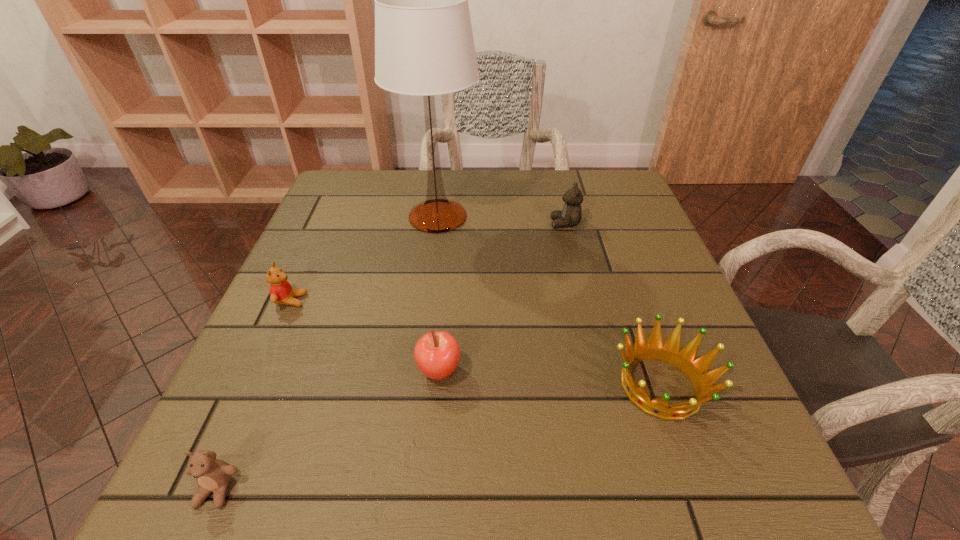
This screenshot has height=540, width=960. I want to click on free space located on the face of the farthest teddy bear, so click(491, 224).

In order to click on vacant space located on the left of the apple in this screenshot , I will do `click(252, 371)`.

This screenshot has height=540, width=960. What are the coordinates of `free space located on the front-facing side of the second nearest teddy bear` in the screenshot? It's located at (442, 300).

Locate an element on the screen. This screenshot has width=960, height=540. vacant position located 0.160m on the back of the crown is located at coordinates (625, 286).

Locate an element on the screen. table lamp positioned at the far edge is located at coordinates (424, 45).

The width and height of the screenshot is (960, 540). I want to click on teddy bear that is positioned at the far edge, so click(571, 214).

You are a GUI agent. You are given a task and a screenshot of the screen. Output one action in this format:
    pyautogui.click(x=<x>, y=<y>)
    Task: Click on the object that is at the near edge
    This screenshot has height=540, width=960.
    Given the screenshot: What is the action you would take?
    pyautogui.click(x=213, y=475)

Where is `object that is positioned at the right edge`? The height and width of the screenshot is (540, 960). object that is positioned at the right edge is located at coordinates (669, 352).

This screenshot has height=540, width=960. Identify the location of object that is at the near left corner. (213, 475).

In the image, there is a desktop. Where is `blank space at the far edge`? blank space at the far edge is located at coordinates (396, 195).